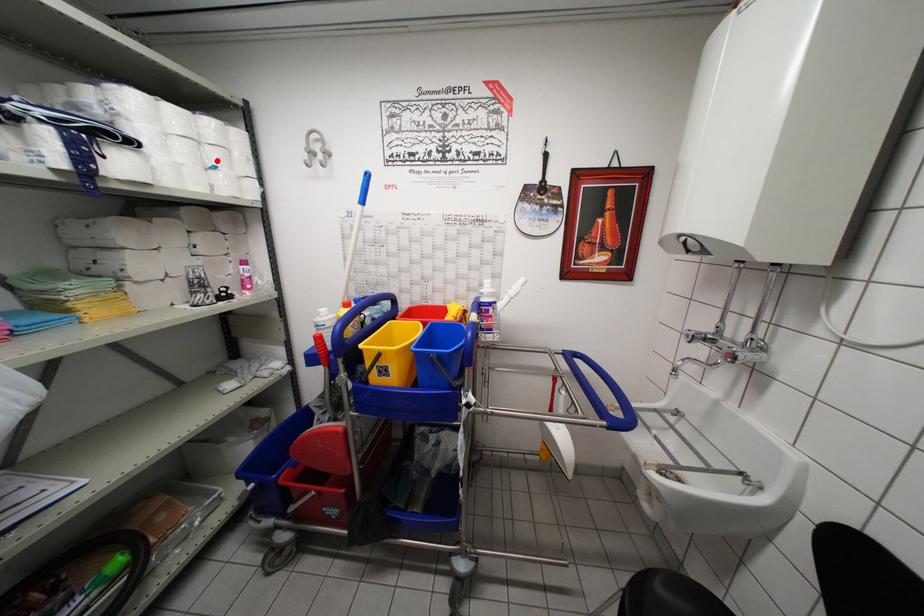
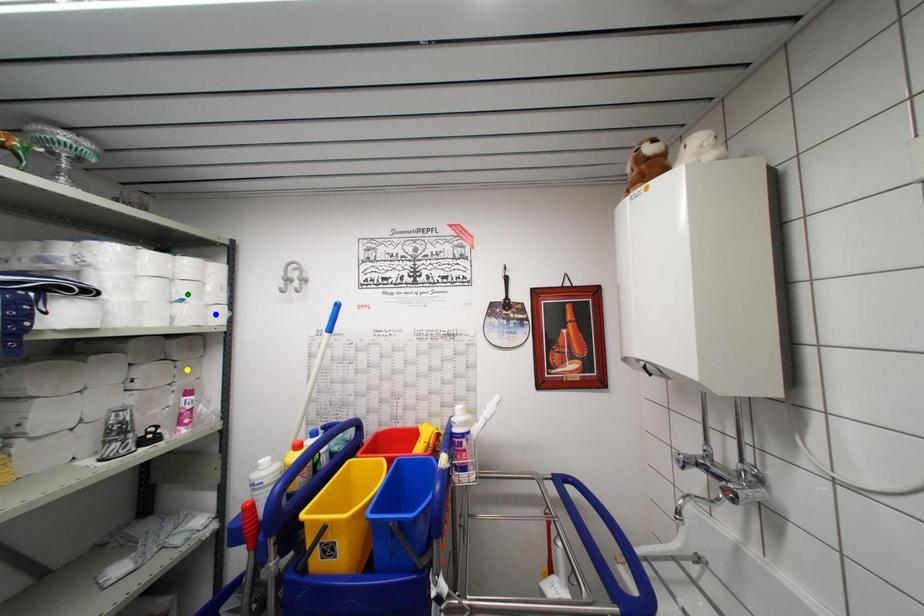
Question: I am providing you with two images of the same scene from different viewpoints. A red point is marked on the first image. You are given multiple points on the second image. Which spot in image 2 lines up with the point in image 1?

Choices:
 (A) green point
 (B) yellow point
 (C) blue point

Answer: (A)